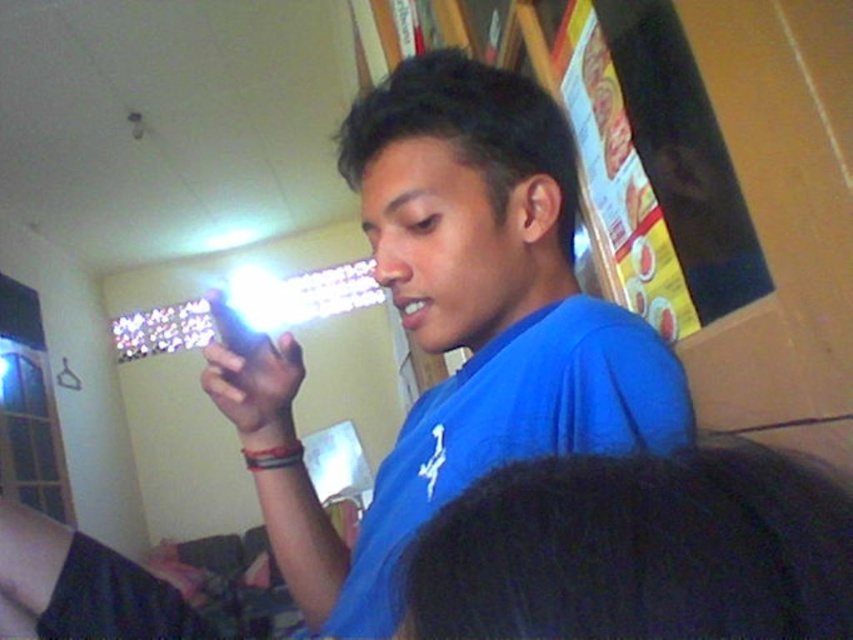
Question: Among these objects, which one is nearest to the camera?

Choices:
 (A) matte black phone at center
 (B) blue matte shirt at center

Answer: (B)

Question: Can you confirm if blue matte shirt at center is thinner than matte black phone at center?

Choices:
 (A) yes
 (B) no

Answer: (B)

Question: Which point is closer to the camera?

Choices:
 (A) (222, 390)
 (B) (335, 624)

Answer: (B)

Question: Is blue matte shirt at center wider than matte black phone at center?

Choices:
 (A) yes
 (B) no

Answer: (A)

Question: Which point appears closest to the camera in this image?

Choices:
 (A) (270, 429)
 (B) (570, 304)

Answer: (B)

Question: Does blue matte shirt at center lie behind matte black phone at center?

Choices:
 (A) no
 (B) yes

Answer: (A)